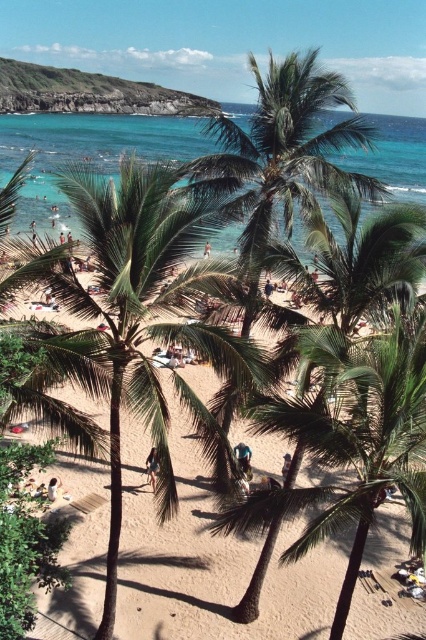
Who is more distant from viewer, (20, 196) or (282, 461)?

The point (20, 196) is behind.

Is point (111, 163) positioned after point (285, 470)?

That is True.

Is point (173, 154) farther from camera compared to point (284, 456)?

Yes, it is.

Where is `clear blue water at upper center`? This screenshot has height=640, width=426. clear blue water at upper center is located at coordinates (88, 150).

What do you see at coordinates (244, 458) in the screenshot? The height and width of the screenshot is (640, 426). I see `light brown leather surfboard at center` at bounding box center [244, 458].

Is light brown leather surfboard at center positioned at the back of blue denim shorts at center?

No, light brown leather surfboard at center is closer to the viewer.

Identify the location of light brown leather surfboard at center. The height and width of the screenshot is (640, 426). (244, 458).

Can you confirm if tan skin person at lower left is positioned to the right of light blue fabric at center?

In fact, tan skin person at lower left is to the left of light blue fabric at center.

What do you see at coordinates (54, 488) in the screenshot? I see `tan skin person at lower left` at bounding box center [54, 488].

Is point (54, 492) behind point (284, 468)?

No, (54, 492) is in front of (284, 468).

The height and width of the screenshot is (640, 426). In order to click on tan skin person at lower left in this screenshot , I will do point(54,488).